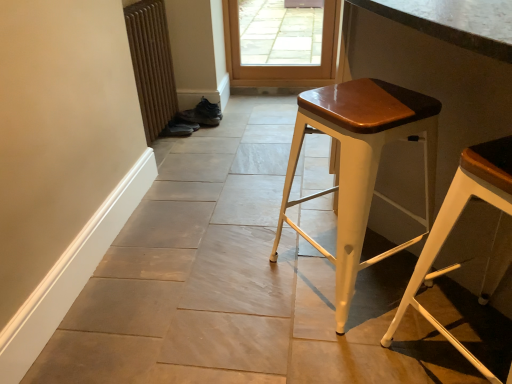
Where is `free location above matte white stool at center, which is counted as the second stool, starting from the right (from a real-world perspective)`? Image resolution: width=512 pixels, height=384 pixels. free location above matte white stool at center, which is counted as the second stool, starting from the right (from a real-world perspective) is located at coordinates (375, 99).